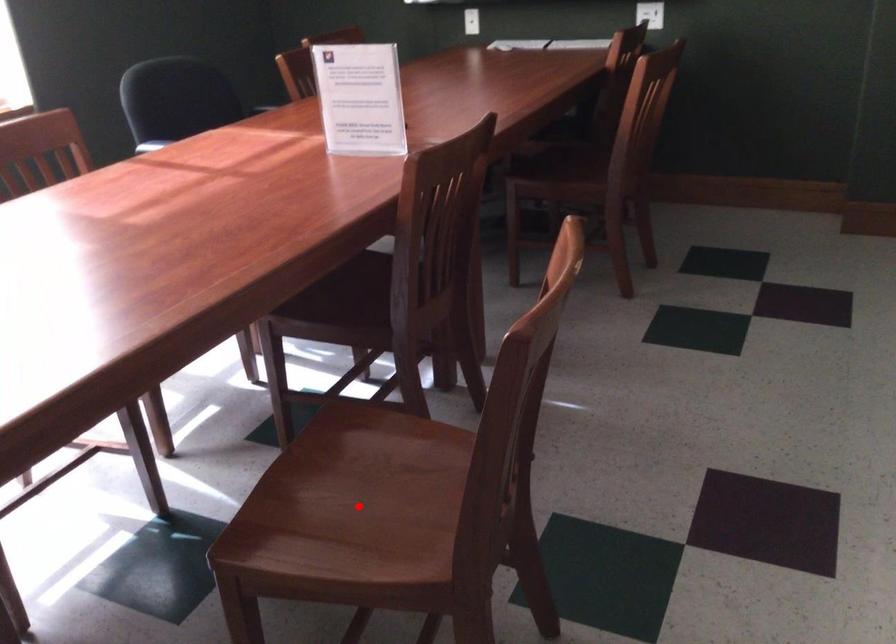
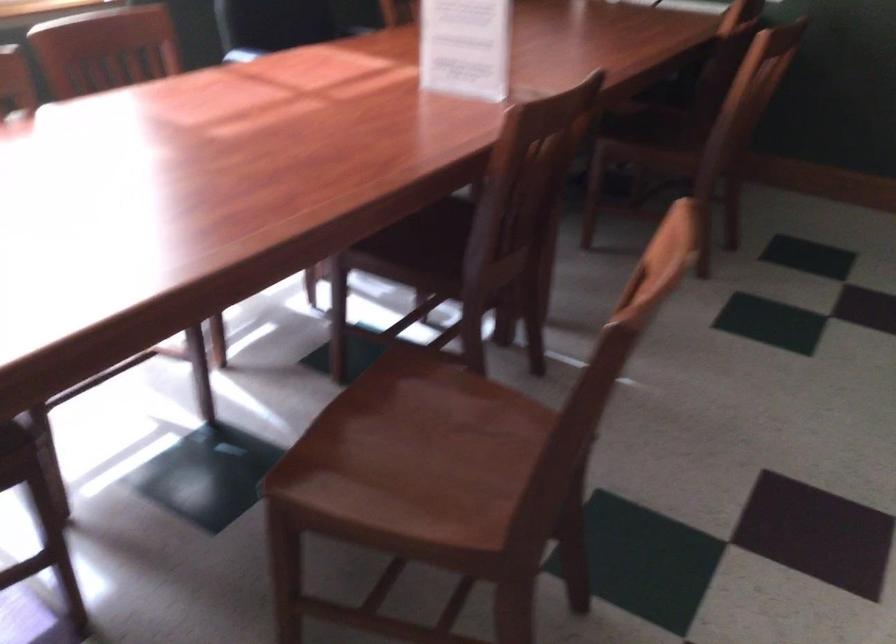
Locate, in the second image, the point that corresponds to the highlighted location in the first image.

(412, 458)